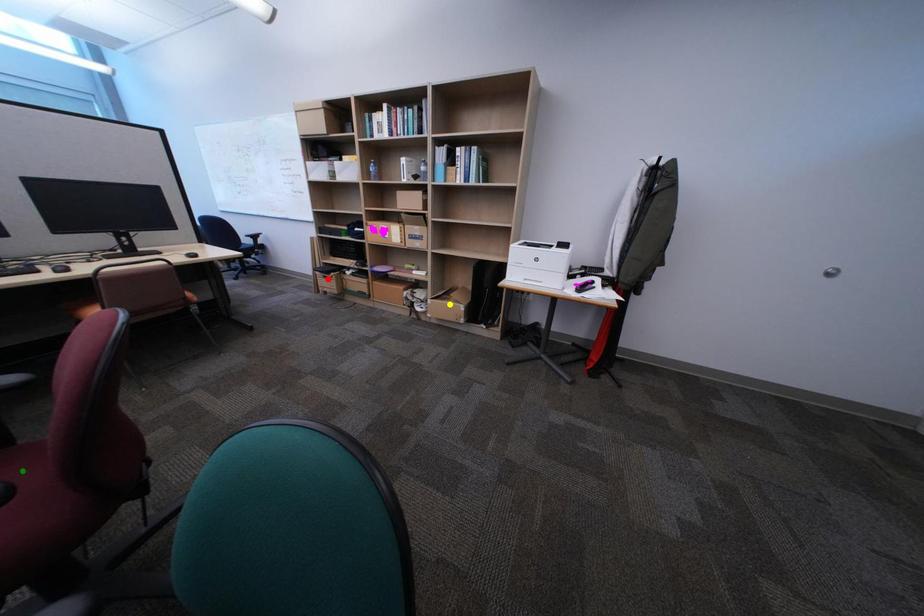
Order these from nearest to farthest:
1. red point
2. yellow point
3. green point

1. red point
2. yellow point
3. green point